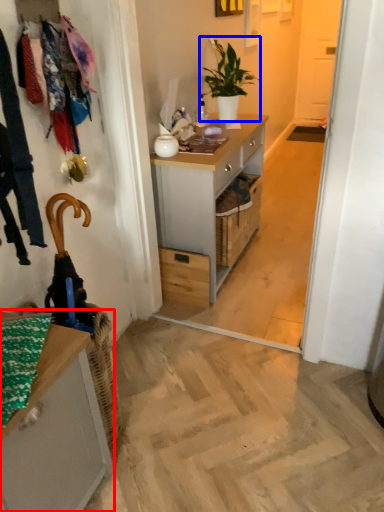
Question: Which object appears closest to the camera in this image, cabinetry (highlighted by a red box) or houseplant (highlighted by a blue box)?

Choices:
 (A) cabinetry
 (B) houseplant

Answer: (A)